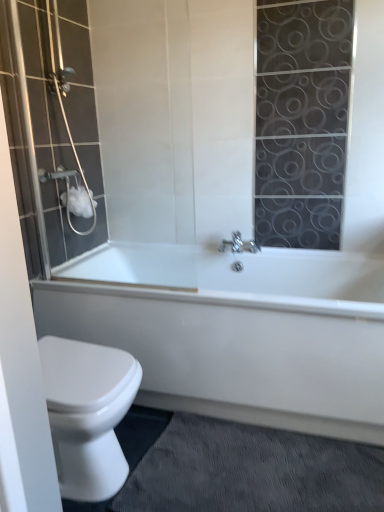
Question: From a real-world perspective, is matte glass shower door at left positioned over white glossy bathtub at lower center based on gravity?

Choices:
 (A) yes
 (B) no

Answer: (A)

Question: Considering the relative sizes of matte glass shower door at left and white glossy bathtub at lower center in the image provided, is matte glass shower door at left taller than white glossy bathtub at lower center?

Choices:
 (A) no
 (B) yes

Answer: (B)

Question: Considering the relative sizes of matte glass shower door at left and white glossy bathtub at lower center in the image provided, is matte glass shower door at left shorter than white glossy bathtub at lower center?

Choices:
 (A) yes
 (B) no

Answer: (B)

Question: Does matte glass shower door at left have a larger size compared to white glossy bathtub at lower center?

Choices:
 (A) yes
 (B) no

Answer: (B)

Question: Does matte glass shower door at left have a lesser width compared to white glossy bathtub at lower center?

Choices:
 (A) yes
 (B) no

Answer: (A)

Question: Does matte glass shower door at left appear on the right side of white glossy bathtub at lower center?

Choices:
 (A) yes
 (B) no

Answer: (B)

Question: Is white glossy bathtub at lower center positioned in front of white matte toilet paper at upper left?

Choices:
 (A) yes
 (B) no

Answer: (A)

Question: Is white glossy bathtub at lower center touching white matte toilet paper at upper left?

Choices:
 (A) no
 (B) yes

Answer: (A)

Question: Considering the relative sizes of white glossy bathtub at lower center and white matte toilet paper at upper left in the image provided, is white glossy bathtub at lower center wider than white matte toilet paper at upper left?

Choices:
 (A) no
 (B) yes

Answer: (B)

Question: Are white glossy bathtub at lower center and white matte toilet paper at upper left located far from each other?

Choices:
 (A) yes
 (B) no

Answer: (B)

Question: Considering the relative sizes of white glossy bathtub at lower center and white matte toilet paper at upper left in the image provided, is white glossy bathtub at lower center thinner than white matte toilet paper at upper left?

Choices:
 (A) no
 (B) yes

Answer: (A)

Question: Is white glossy bathtub at lower center turned away from white matte toilet paper at upper left?

Choices:
 (A) no
 (B) yes

Answer: (A)

Question: Could you tell me if white glossy bathtub at lower center is facing gray textured bath mat at lower right?

Choices:
 (A) yes
 (B) no

Answer: (A)